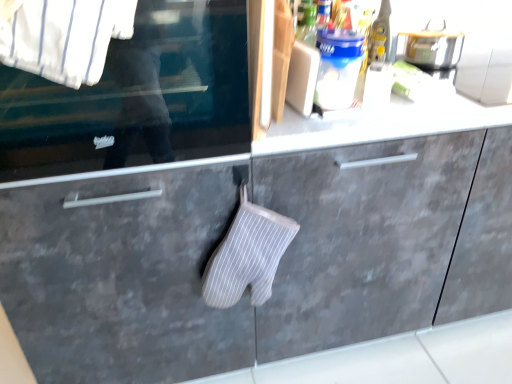
Question: Is white fabric oven mitt at center to the left of white striped fabric oven mitt at center from the viewer's perspective?

Choices:
 (A) yes
 (B) no

Answer: (B)

Question: Is white fabric oven mitt at center completely or partially outside of white striped fabric oven mitt at center?

Choices:
 (A) no
 (B) yes

Answer: (B)

Question: From the image's perspective, does white fabric oven mitt at center appear higher than white striped fabric oven mitt at center?

Choices:
 (A) no
 (B) yes

Answer: (B)

Question: Does white fabric oven mitt at center have a greater width compared to white striped fabric oven mitt at center?

Choices:
 (A) yes
 (B) no

Answer: (A)

Question: From a real-world perspective, is white fabric oven mitt at center positioned over white striped fabric oven mitt at center based on gravity?

Choices:
 (A) no
 (B) yes

Answer: (A)

Question: Is white fabric oven mitt at center shorter than white striped fabric oven mitt at center?

Choices:
 (A) yes
 (B) no

Answer: (B)

Question: Is gray matte drawer at lower left facing towards metallic silver toaster at upper right?

Choices:
 (A) no
 (B) yes

Answer: (A)

Question: Is gray matte drawer at lower left shorter than metallic silver toaster at upper right?

Choices:
 (A) yes
 (B) no

Answer: (B)

Question: Is gray matte drawer at lower left to the right of metallic silver toaster at upper right from the viewer's perspective?

Choices:
 (A) yes
 (B) no

Answer: (B)

Question: Is gray matte drawer at lower left far from metallic silver toaster at upper right?

Choices:
 (A) no
 (B) yes

Answer: (B)

Question: Would you say metallic silver toaster at upper right is part of gray matte drawer at lower left's contents?

Choices:
 (A) no
 (B) yes

Answer: (A)

Question: From a real-world perspective, is gray matte drawer at lower left on metallic silver toaster at upper right?

Choices:
 (A) no
 (B) yes

Answer: (A)

Question: From the image's perspective, is transparent glass window at center under white striped fabric at upper left?

Choices:
 (A) yes
 (B) no

Answer: (B)